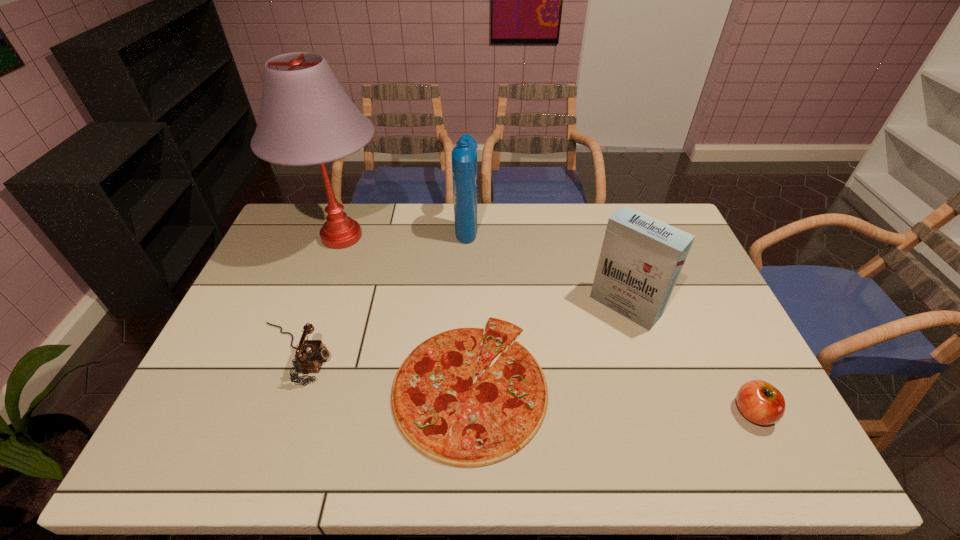
Where is `free space located 0.120m on the dial of the telephone`? free space located 0.120m on the dial of the telephone is located at coordinates (377, 354).

The height and width of the screenshot is (540, 960). I want to click on vacant space located on the back of the apple, so coord(719,343).

Locate an element on the screen. vacant space located 0.150m on the left of the shortest object is located at coordinates (335, 383).

The height and width of the screenshot is (540, 960). What are the coordinates of `table lamp that is at the far edge` in the screenshot? It's located at (306, 118).

You are a GUI agent. You are given a task and a screenshot of the screen. Output one action in this format:
    pyautogui.click(x=<x>, y=<y>)
    Task: Click on the shampoo positioned at the far edge
    This screenshot has width=960, height=540.
    Given the screenshot: What is the action you would take?
    pyautogui.click(x=464, y=155)

Where is `apple at the near edge`? apple at the near edge is located at coordinates (760, 402).

This screenshot has height=540, width=960. What are the coordinates of `pizza situated at the near edge` in the screenshot? It's located at (440, 412).

Locate an element on the screen. table lamp located at the left edge is located at coordinates (306, 118).

Identify the location of telephone present at the left edge. (310, 354).

Where is `object that is at the right edge`? Image resolution: width=960 pixels, height=540 pixels. object that is at the right edge is located at coordinates (760, 402).